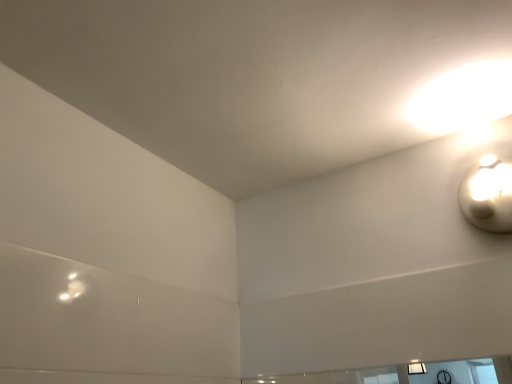
What do you see at coordinates (488, 195) in the screenshot? I see `matte white lamp at upper right` at bounding box center [488, 195].

Find the location of a particular element. This screenshot has height=384, width=512. matte white lamp at upper right is located at coordinates (488, 195).

I want to click on matte white lamp at upper right, so click(x=488, y=195).